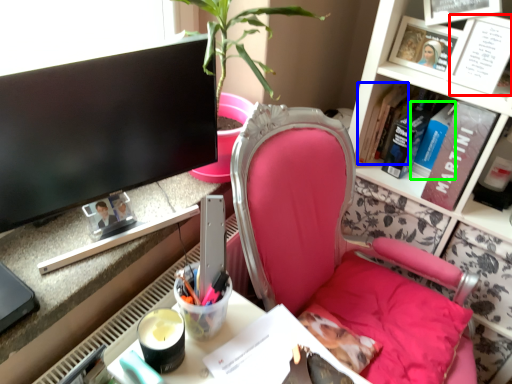
Question: Considering the real-world distances, which object is closest to book (highlighted by a red box)? book (highlighted by a blue box) or book (highlighted by a green box).

Choices:
 (A) book
 (B) book

Answer: (B)